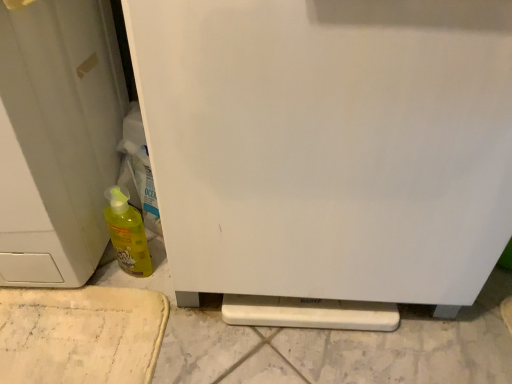
I want to click on white matte door at left, so (x=57, y=139).

Locate an element on the screen. This screenshot has height=384, width=512. white matte refrigerator at center is located at coordinates (328, 152).

Is yellow translucent bottle at lower left facing towards white matte door at left?

No, yellow translucent bottle at lower left does not turn towards white matte door at left.

Which object is positioned more to the right, yellow translucent bottle at lower left or white matte door at left?

yellow translucent bottle at lower left is more to the right.

How many degrees apart are the facing directions of yellow translucent bottle at lower left and white matte door at left?

The angle between the facing direction of yellow translucent bottle at lower left and the facing direction of white matte door at left is 0.301 degrees.

Are yellow translucent bottle at lower left and white matte refrigerator at center making contact?

yellow translucent bottle at lower left and white matte refrigerator at center are not in contact.

From a real-world perspective, relative to white matte refrigerator at center, is yellow translucent bottle at lower left vertically above or below?

From a real-world perspective, yellow translucent bottle at lower left is physically below white matte refrigerator at center.

Is yellow translucent bottle at lower left closer to camera compared to white matte refrigerator at center?

No, it is not.

Is yellow translucent bottle at lower left at the left side of white matte refrigerator at center?

Yes, yellow translucent bottle at lower left is to the left of white matte refrigerator at center.

Is white matte refrigerator at center bigger than yellow translucent bottle at lower left?

Yes.

From the image's perspective, between white matte refrigerator at center and yellow translucent bottle at lower left, which one is located above?

From the image's view, white matte refrigerator at center is above.

Considering the positions of points (503, 27) and (140, 251), is point (503, 27) closer to camera compared to point (140, 251)?

Yes, point (503, 27) is in front of point (140, 251).

Identify the location of bottle on the left side of white matte refrigerator at center. Image resolution: width=512 pixels, height=384 pixels. (x=127, y=233).

This screenshot has height=384, width=512. What are the coordinates of `bottle lying below the white matte door at left (from the image's perspective)` in the screenshot? It's located at (127, 233).

Which is less distant, (61, 171) or (126, 221)?

Point (61, 171) is closer to the camera than point (126, 221).

Relative to yellow translucent bottle at lower left, is white matte door at left in front or behind?

Clearly, white matte door at left is in front of yellow translucent bottle at lower left.

From the image's perspective, is white matte door at left above or below yellow translucent bottle at lower left?

Clearly, from the image's perspective, white matte door at left is above yellow translucent bottle at lower left.

From the picture: Is white matte refrigerator at center not within white matte door at left?

Indeed, white matte refrigerator at center is completely outside white matte door at left.

Is white matte refrigerator at center looking in the opposite direction of white matte door at left?

No.

Is white matte refrigerator at center not close to white matte door at left?

No, there isn't a large distance between white matte refrigerator at center and white matte door at left.

Considering the relative positions of white matte refrigerator at center and white matte door at left in the image provided, is white matte refrigerator at center to the right of white matte door at left from the viewer's perspective?

Indeed, white matte refrigerator at center is positioned on the right side of white matte door at left.

Locate an element on the screen. door above the white matte refrigerator at center (from the image's perspective) is located at coordinates (57, 139).

Is white matte door at left positioned beyond the bounds of white matte refrigerator at center?

That's correct, white matte door at left is outside of white matte refrigerator at center.

Is white matte door at left turned away from white matte refrigerator at center?

white matte door at left does not have its back to white matte refrigerator at center.

The height and width of the screenshot is (384, 512). What are the coordinates of `bottle that appears behind the white matte door at left` in the screenshot? It's located at (127, 233).

Locate an element on the screen. The image size is (512, 384). refrigerator lying on the right of yellow translucent bottle at lower left is located at coordinates (328, 152).

Considering their positions, is yellow translucent bottle at lower left positioned closer to white matte door at left than white matte refrigerator at center?

yellow translucent bottle at lower left is closer to white matte door at left.

From the image, which object appears to be nearer to yellow translucent bottle at lower left, white matte door at left or white matte refrigerator at center?

Based on the image, white matte door at left appears to be nearer to yellow translucent bottle at lower left.

Looking at the image, which one is located closer to white matte refrigerator at center, yellow translucent bottle at lower left or white matte door at left?

Among the two, white matte door at left is located nearer to white matte refrigerator at center.

Estimate the real-world distances between objects in this image. Which object is closer to white matte door at left, white matte refrigerator at center or yellow translucent bottle at lower left?

yellow translucent bottle at lower left is positioned closer to the anchor white matte door at left.

Based on their spatial positions, is white matte refrigerator at center or white matte door at left further from yellow translucent bottle at lower left?

white matte refrigerator at center lies further to yellow translucent bottle at lower left than the other object.

From the image, which object appears to be farther from white matte refrigerator at center, white matte door at left or yellow translucent bottle at lower left?

Based on the image, yellow translucent bottle at lower left appears to be further to white matte refrigerator at center.

Locate an element on the screen. The height and width of the screenshot is (384, 512). bottle between white matte door at left and white matte refrigerator at center from left to right is located at coordinates (127, 233).